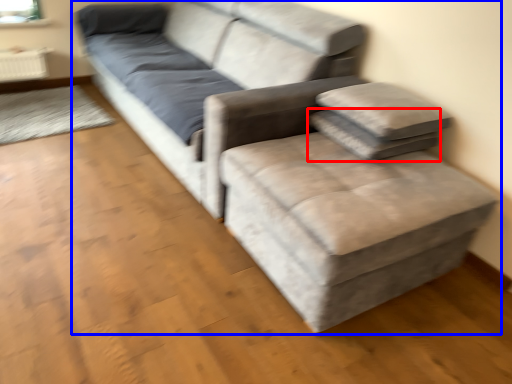
Question: Which object is closer to the camera taking this photo, pillow (highlighted by a red box) or studio couch (highlighted by a blue box)?

Choices:
 (A) pillow
 (B) studio couch

Answer: (B)